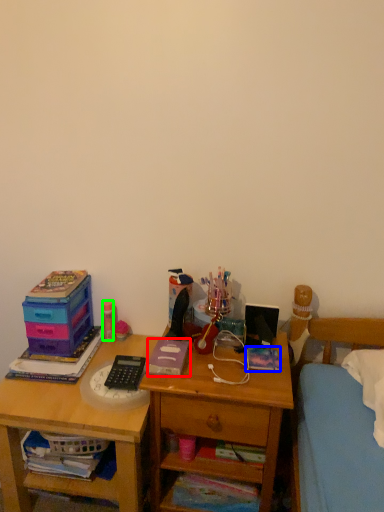
Question: Which is farther away from book (highlighted by a red box)? book (highlighted by a blue box) or stationery (highlighted by a green box)?

Choices:
 (A) book
 (B) stationery

Answer: (B)